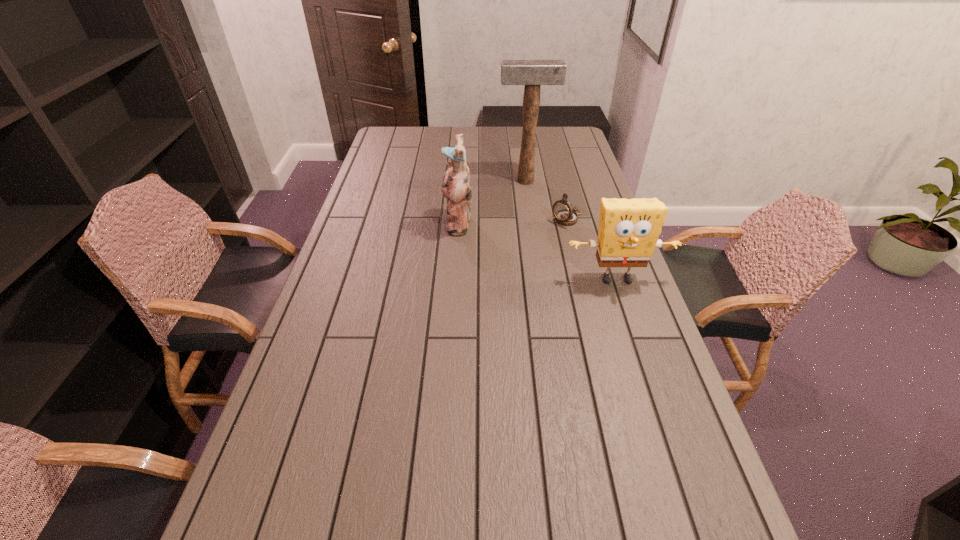
This screenshot has width=960, height=540. Identify the location of vacant space on the desktop that is between the leftmost object and the nearest object and is positioned on the striking surface of the farthest object. (537, 251).

Where is `vacant space on the desktop that is between the figurine and the third tallest object and is positioned on the face of the compass`? The height and width of the screenshot is (540, 960). vacant space on the desktop that is between the figurine and the third tallest object and is positioned on the face of the compass is located at coordinates (529, 248).